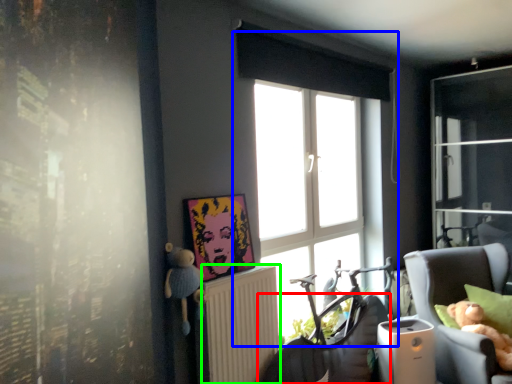
Question: Estimate the real-world distances between objects in this image. Which object is farther from swivel chair (highlighted by a red box), window (highlighted by a blue box) or radiator (highlighted by a green box)?

Choices:
 (A) window
 (B) radiator

Answer: (A)